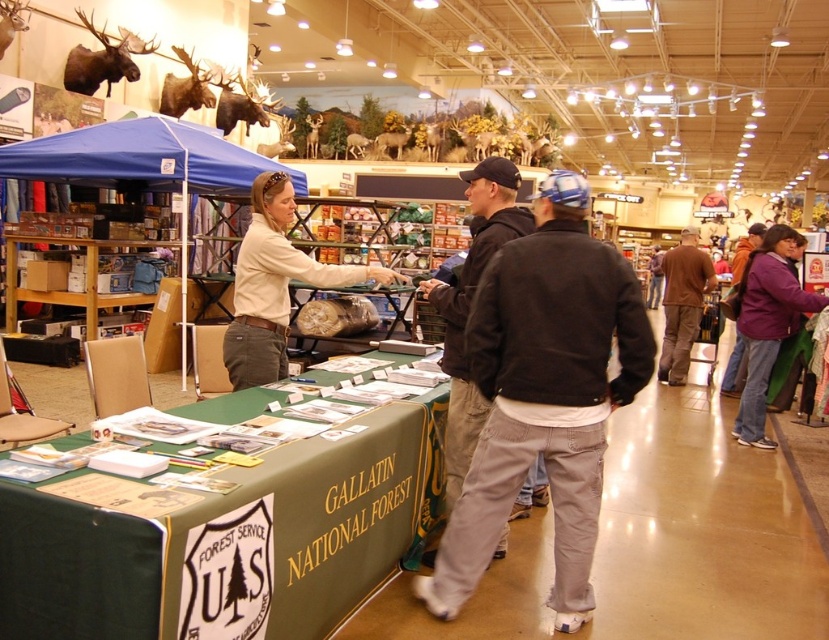
Is black matte jacket at center above purple fleece jacket at right?

Yes, black matte jacket at center is above purple fleece jacket at right.

Does black matte jacket at center have a smaller size compared to purple fleece jacket at right?

Yes.

Is point (473, 214) less distant than point (762, 392)?

Yes.

Find the location of a particular element. The height and width of the screenshot is (640, 829). black matte jacket at center is located at coordinates (469, 304).

Is black cotton jacket at center smaller than brown cotton shirt at center?

No, black cotton jacket at center is not smaller than brown cotton shirt at center.

Looking at this image, between black cotton jacket at center and brown cotton shirt at center, which one appears on the right side from the viewer's perspective?

brown cotton shirt at center

This screenshot has height=640, width=829. Find the location of `black cotton jacket at center`. black cotton jacket at center is located at coordinates click(544, 394).

Is point (331, 499) in front of point (696, 284)?

That is True.

What do you see at coordinates (226, 538) in the screenshot? This screenshot has height=640, width=829. I see `green fabric table at center` at bounding box center [226, 538].

Which is behind, point (163, 637) or point (667, 291)?

The point (667, 291) is more distant.

Locate an element on the screen. green fabric table at center is located at coordinates (226, 538).